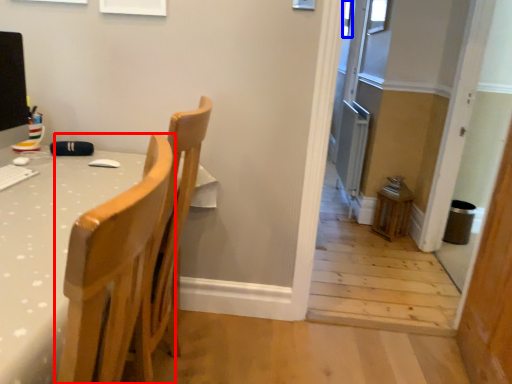
Question: Which point is further to the camera, chair (highlighted by a red box) or window (highlighted by a blue box)?

Choices:
 (A) chair
 (B) window

Answer: (B)